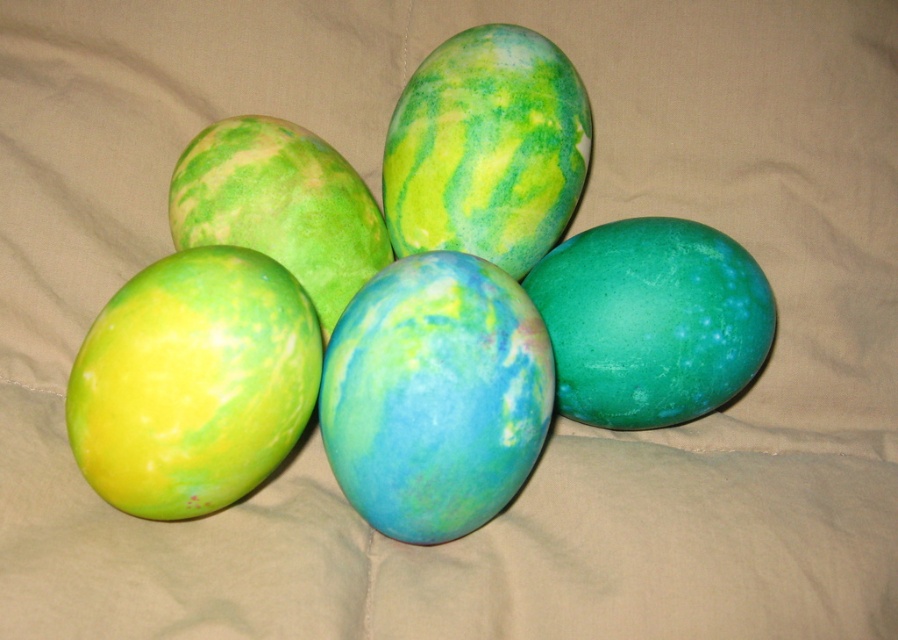
You are standing 5 feet away from the eggs. If you move forward 1.35 feet, will you be closer to the point at coordinates point (383, 298)?

The distance of point (383, 298) from viewer is 3.65 feet. Moving forward 1.35 feet from your initial position of 5 feet would bring you to 3.65 feet away, which matches the point (383, 298) distance. Therefore, yes, you will be at the point (383, 298).